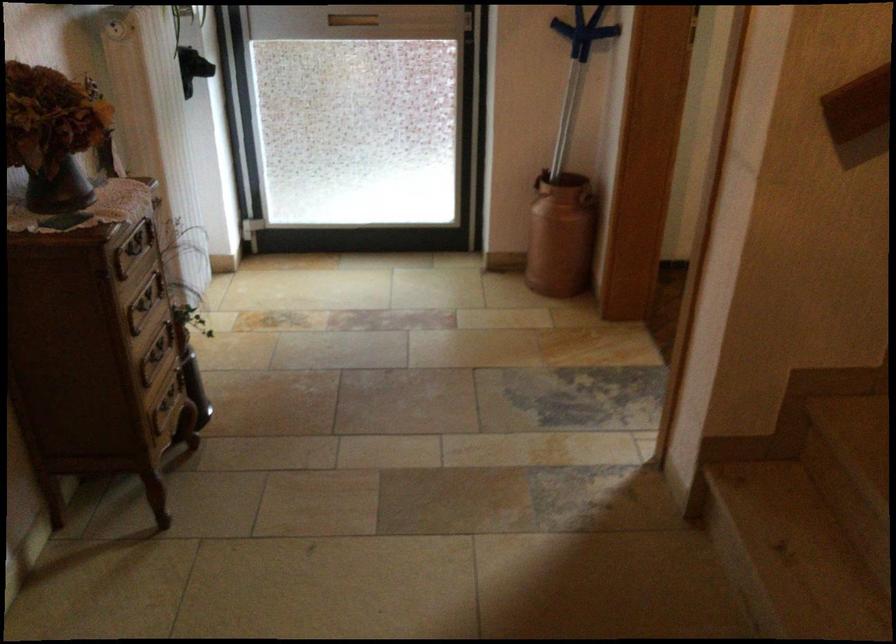
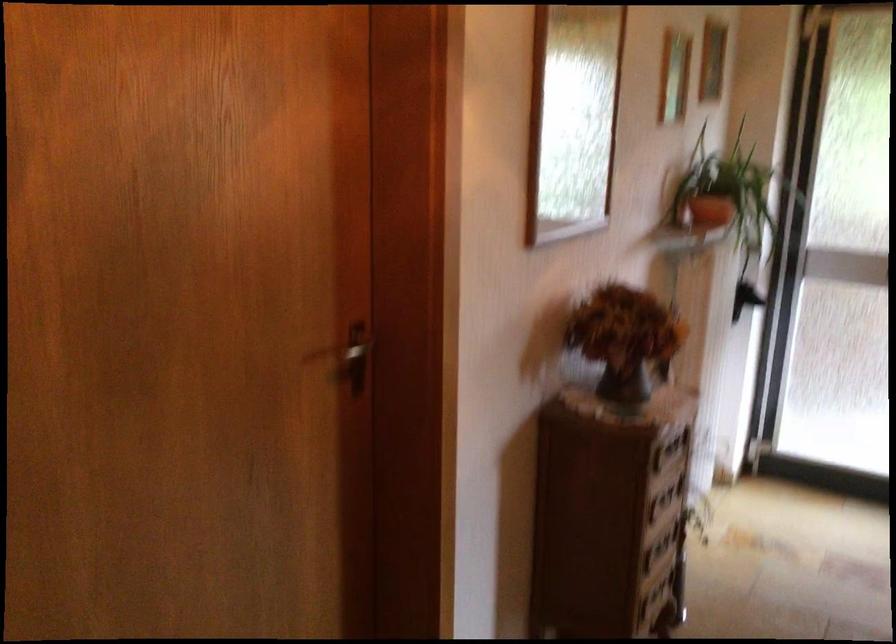
Where in the second image is the point corresponding to pixel 140 310 from the first image?

(659, 504)